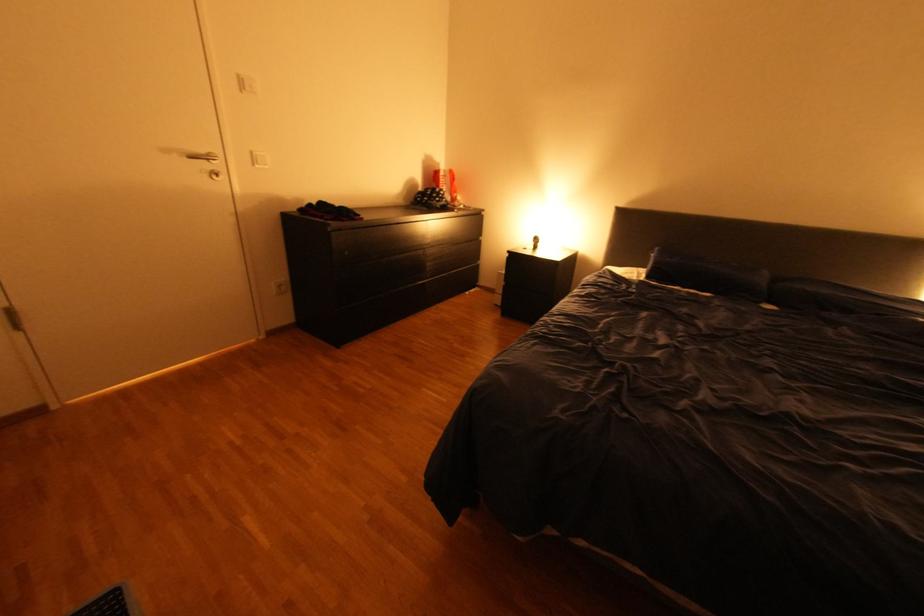
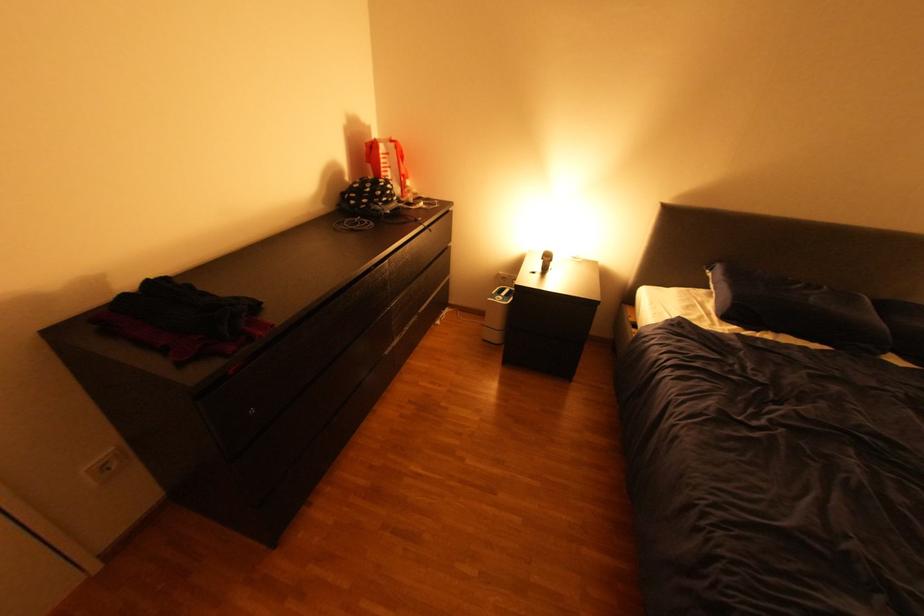
The point at (x=448, y=164) is marked in the first image. Where is the corresponding point in the second image?

(379, 129)